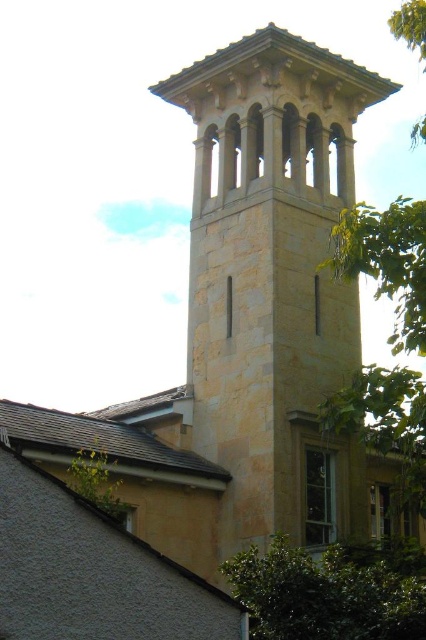
Can you confirm if beige stone church tower at upper center is positioned below green leafy tree at upper left?

Actually, beige stone church tower at upper center is above green leafy tree at upper left.

Is beige stone church tower at upper center smaller than green leafy tree at upper left?

Incorrect, beige stone church tower at upper center is not smaller in size than green leafy tree at upper left.

Who is more forward, (371, 90) or (97, 492)?

Positioned in front is point (97, 492).

This screenshot has height=640, width=426. What are the coordinates of `beige stone church tower at upper center` in the screenshot? It's located at (273, 284).

Does point (310, 125) come farther from viewer compared to point (408, 566)?

Yes, it is behind point (408, 566).

Which is behind, point (330, 509) or point (221, 568)?

Positioned behind is point (330, 509).

This screenshot has height=640, width=426. What are the coordinates of `beige stone church tower at upper center` in the screenshot? It's located at (273, 284).

Does green leafy tree at lower right have a smaller size compared to green leafy tree at upper left?

No, green leafy tree at lower right is not smaller than green leafy tree at upper left.

Identify the location of green leafy tree at lower right. This screenshot has width=426, height=640. click(x=331, y=589).